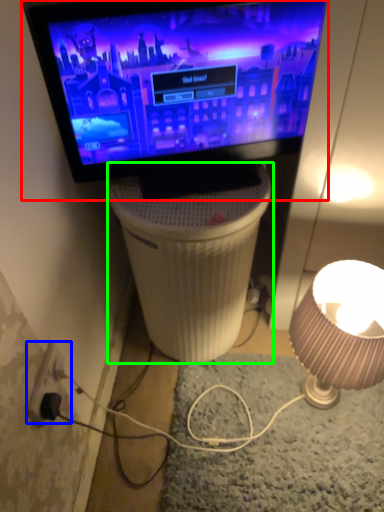
Question: Which is nearer to the television (highlighted by a red box)? electric outlet (highlighted by a blue box) or table (highlighted by a green box).

Choices:
 (A) electric outlet
 (B) table

Answer: (B)